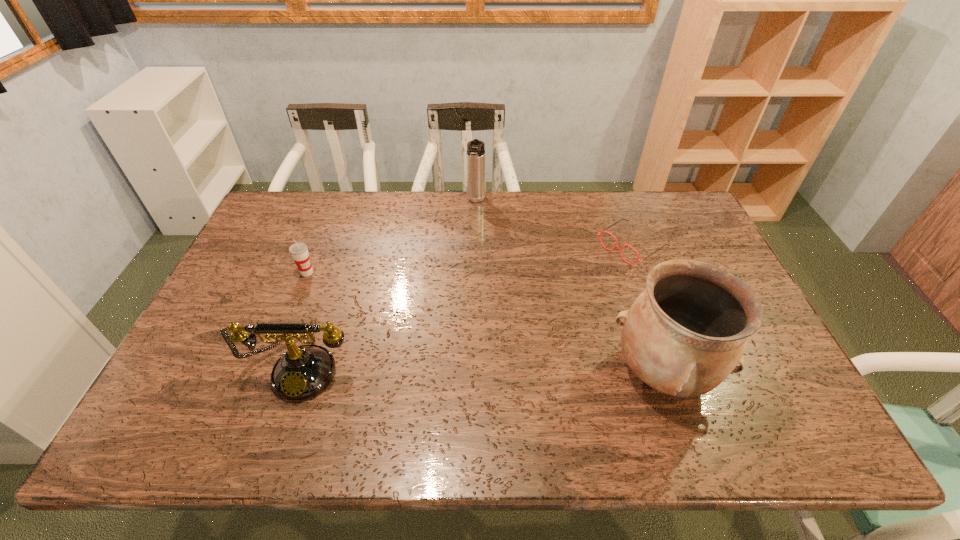
Where is `free space located on the side of the second shortest object with the logo`? Image resolution: width=960 pixels, height=540 pixels. free space located on the side of the second shortest object with the logo is located at coordinates (374, 313).

Identify the location of vacant space situated on the side of the second shortest object with the logo. Image resolution: width=960 pixels, height=540 pixels. (344, 294).

Find the location of `free region located on the side of the second shortest object with the logo`. free region located on the side of the second shortest object with the logo is located at coordinates (364, 306).

Where is `free space located on the handle side of the farthest object`? The image size is (960, 540). free space located on the handle side of the farthest object is located at coordinates (471, 227).

Find the location of a particular element. This screenshot has height=540, width=960. vacant region located 0.130m on the handle side of the farthest object is located at coordinates (470, 232).

I want to click on free space located 0.150m on the handle side of the farthest object, so click(x=469, y=236).

Identify the location of spectacles that is at the far edge. This screenshot has height=540, width=960. (620, 249).

Locate an element on the screen. thermos bottle that is positioned at the far edge is located at coordinates (476, 189).

Image resolution: width=960 pixels, height=540 pixels. I want to click on telephone situated at the near edge, so click(302, 372).

You are a GUI agent. You are given a task and a screenshot of the screen. Output one action in this format:
    pyautogui.click(x=<x>, y=<y>)
    Task: Click on the urn at the near edge
    This screenshot has height=540, width=960.
    Given the screenshot: What is the action you would take?
    click(x=685, y=333)